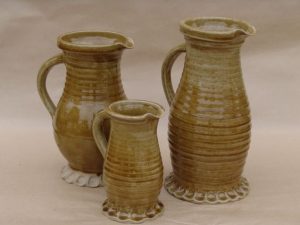
I want to click on small pitcher handle, so click(98, 126).